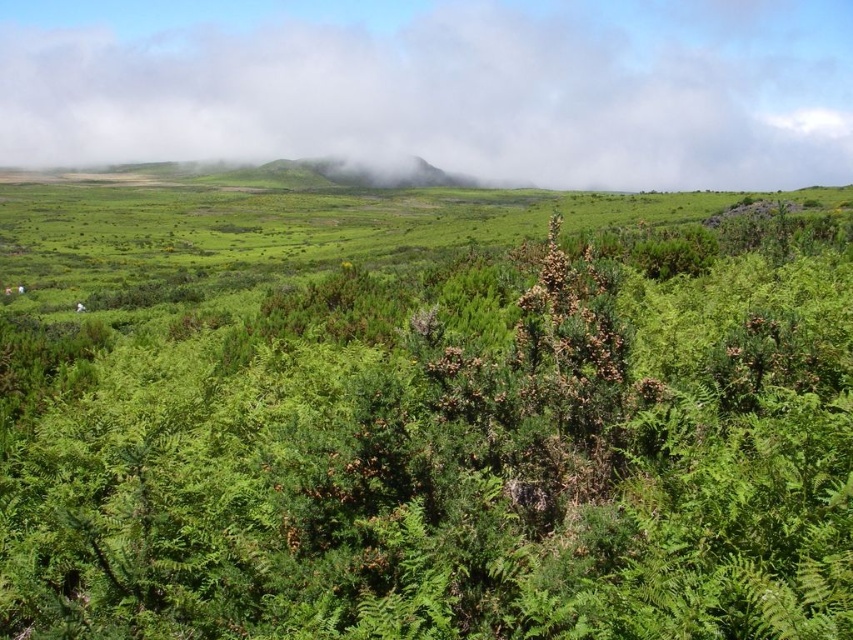
You are a drone operator who needs to fly a drone from the green leafy shrub at center to the white fluffy cloud at upper center. Considering the drone has a maximum range of 300 meters, will it be able to reach the cloud?

The distance between the green leafy shrub at center and the white fluffy cloud at upper center is 312.98 meters, which exceeds the drone operator has a maximum range of 300 meters. Therefore, the drone will not be able to reach the cloud.

You are standing in the lush landscape and want to walk from the point closer to you to the farther point. Which path would you take between the two points, point (x=544, y=602) and point (x=779, y=92)?

You should take the path leading from point (x=544, y=602) to point (x=779, y=92) since point (x=544, y=602) is closer to you and the other is farther away in the background.

You are a bird flying over the landscape and want to land on the green leafy shrub at center. Which direction should you fly from the white fluffy cloud at upper center to reach it?

The green leafy shrub at center is positioned under the white fluffy cloud at upper center, so you should fly downward from the white fluffy cloud at upper center to reach it.